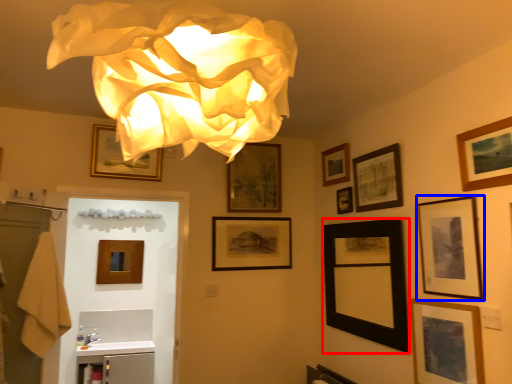
Question: Which of the following is the closest to the observer, picture frame (highlighted by a red box) or picture frame (highlighted by a blue box)?

Choices:
 (A) picture frame
 (B) picture frame

Answer: (B)